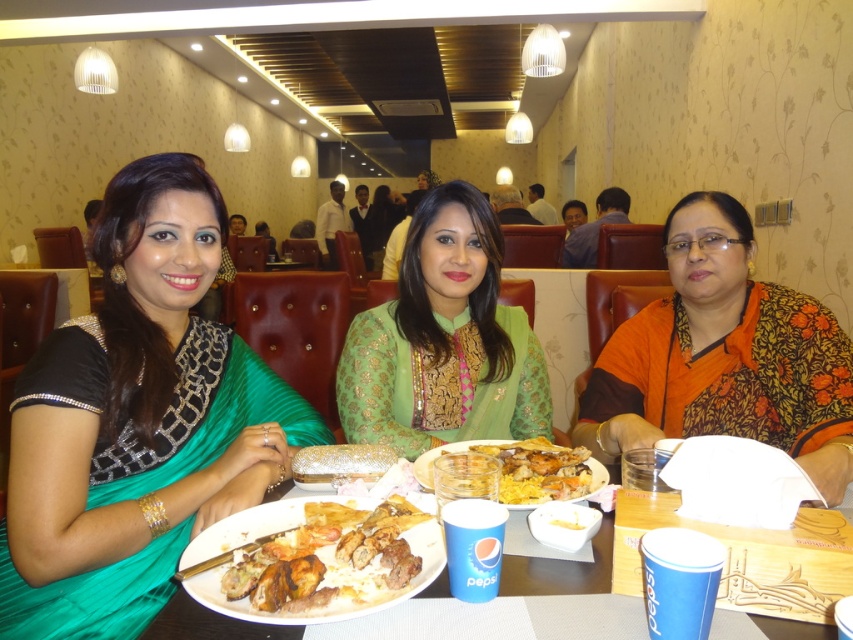
Question: Among these points, which one is nearest to the camera?

Choices:
 (A) (177, 612)
 (B) (386, 422)
 (C) (369, 604)

Answer: (C)

Question: Observing the image, what is the correct spatial positioning of green silk saree at center in reference to white paper plate at center?

Choices:
 (A) below
 (B) above

Answer: (B)

Question: Among these points, which one is nearest to the camera?

Choices:
 (A) (769, 342)
 (B) (171, 381)

Answer: (B)

Question: Which of the following is the farthest from the observer?

Choices:
 (A) green embroidered kurta at center
 (B) translucent glass bowl at center
 (C) white paper plate at center

Answer: (A)

Question: Is green embroidered kurta at center thinner than white paper plate at center?

Choices:
 (A) yes
 (B) no

Answer: (A)

Question: Is white paper plate at center closer to camera compared to translucent glass bowl at center?

Choices:
 (A) yes
 (B) no

Answer: (A)